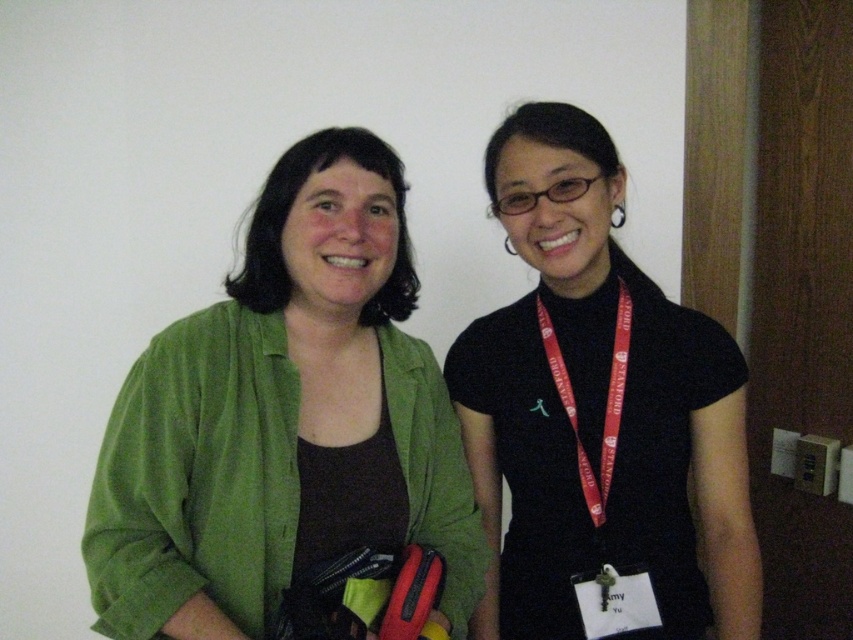
The image size is (853, 640). I want to click on black matte dress at center, so click(599, 417).

Does black matte dress at center appear on the left side of red fabric lanyard at center?

Correct, you'll find black matte dress at center to the left of red fabric lanyard at center.

Who is more distant from viewer, [746,554] or [585,456]?

Positioned behind is point [746,554].

You are a GUI agent. You are given a task and a screenshot of the screen. Output one action in this format:
    pyautogui.click(x=<x>, y=<y>)
    Task: Click on the black matte dress at center
    The width and height of the screenshot is (853, 640).
    Given the screenshot: What is the action you would take?
    pyautogui.click(x=599, y=417)

Can you confirm if black matte dress at center is positioned below matte green neck at center?

Indeed, black matte dress at center is positioned under matte green neck at center.

Measure the distance between point (x=647, y=294) and camera.

Point (x=647, y=294) is 4.28 feet away from camera.

Between point (564, 467) and point (349, 349), which one is positioned behind?

The point (564, 467) is behind.

You are a GUI agent. You are given a task and a screenshot of the screen. Output one action in this format:
    pyautogui.click(x=<x>, y=<y>)
    Task: Click on the black matte dress at center
    The height and width of the screenshot is (640, 853).
    Given the screenshot: What is the action you would take?
    pyautogui.click(x=599, y=417)

Does green cotton shirt at center have a smaller size compared to red fabric lanyard at center?

Actually, green cotton shirt at center might be larger than red fabric lanyard at center.

Describe the element at coordinates (281, 428) in the screenshot. I see `green cotton shirt at center` at that location.

You are a GUI agent. You are given a task and a screenshot of the screen. Output one action in this format:
    pyautogui.click(x=<x>, y=<y>)
    Task: Click on the green cotton shirt at center
    
    Given the screenshot: What is the action you would take?
    point(281,428)